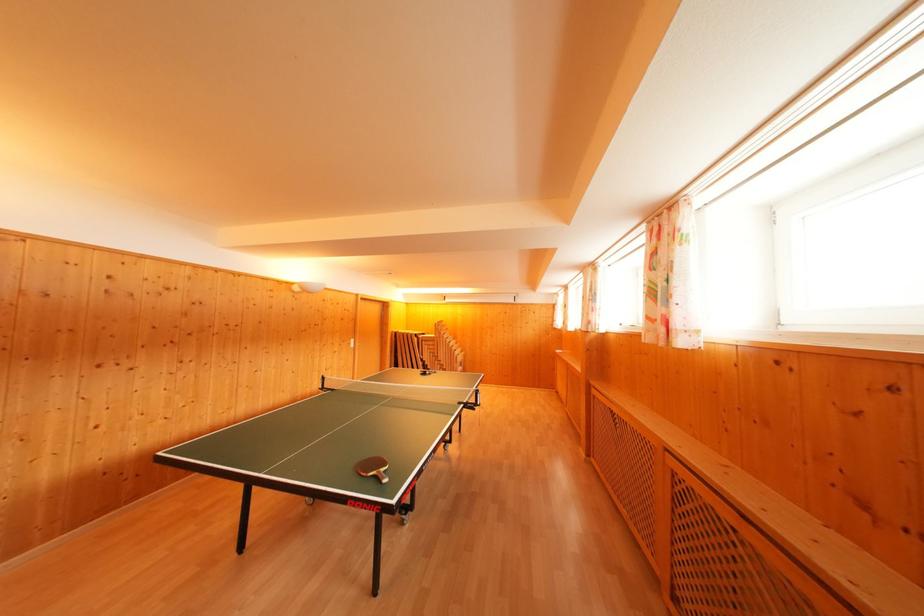
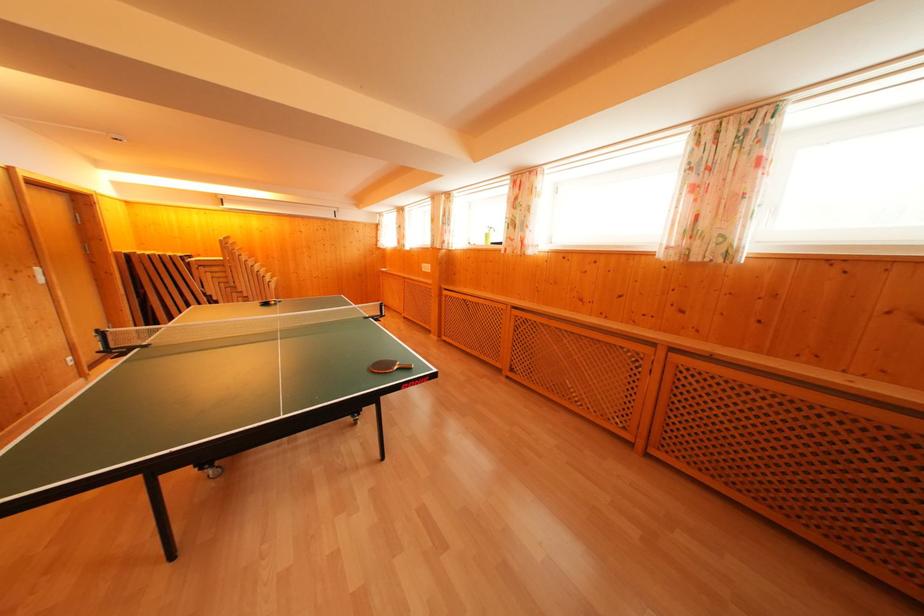
In the second image, find the point that corresponds to (x=427, y=365) in the first image.

(210, 300)